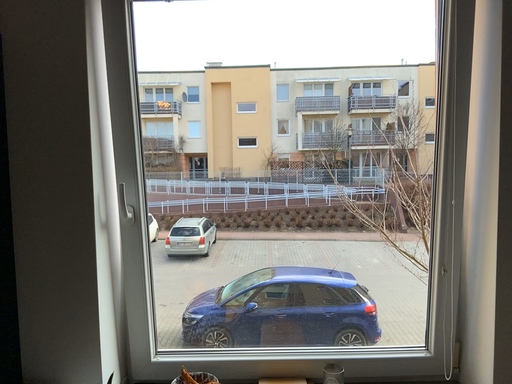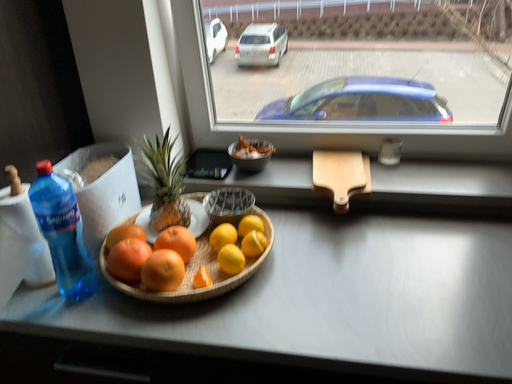
Question: How did the camera likely rotate when shooting the video?

Choices:
 (A) rotated upward
 (B) rotated downward

Answer: (B)